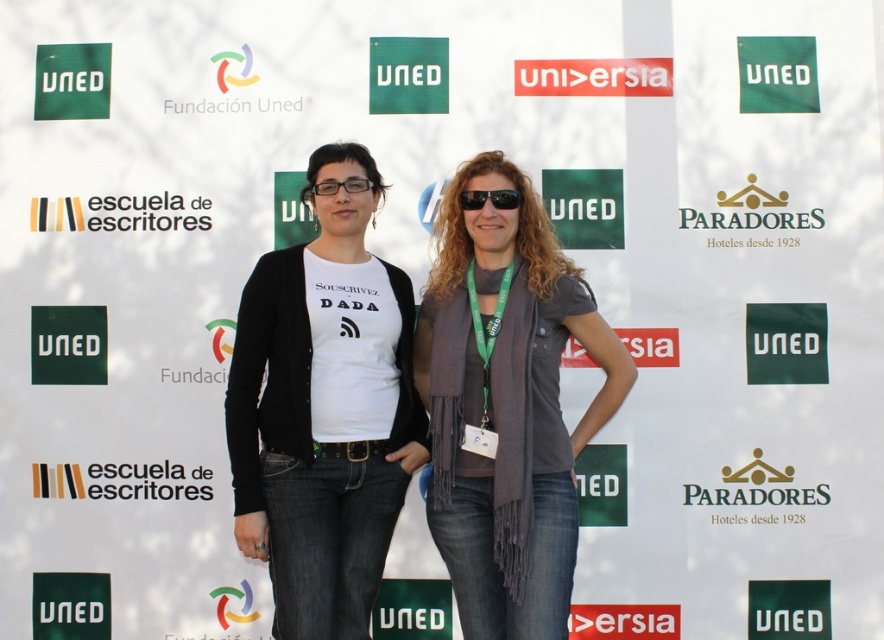
Question: Does black matte cardigan at center appear over black plastic glasses at center?

Choices:
 (A) yes
 (B) no

Answer: (B)

Question: Is the position of black matte cardigan at center less distant than that of gray scarf at center?

Choices:
 (A) yes
 (B) no

Answer: (B)

Question: Which of these objects is positioned closest to the black reflective sunglasses at center?

Choices:
 (A) gray scarf at center
 (B) black plastic glasses at center
 (C) black matte cardigan at center

Answer: (A)

Question: Does gray scarf at center have a lesser width compared to black plastic glasses at center?

Choices:
 (A) yes
 (B) no

Answer: (B)

Question: Which point is farther from the camera taking this photo?

Choices:
 (A) (364, 188)
 (B) (496, 324)
 (C) (512, 189)

Answer: (A)

Question: Which object appears closest to the camera in this image?

Choices:
 (A) black plastic glasses at center
 (B) gray scarf at center
 (C) black reflective sunglasses at center
 (D) black matte cardigan at center

Answer: (B)